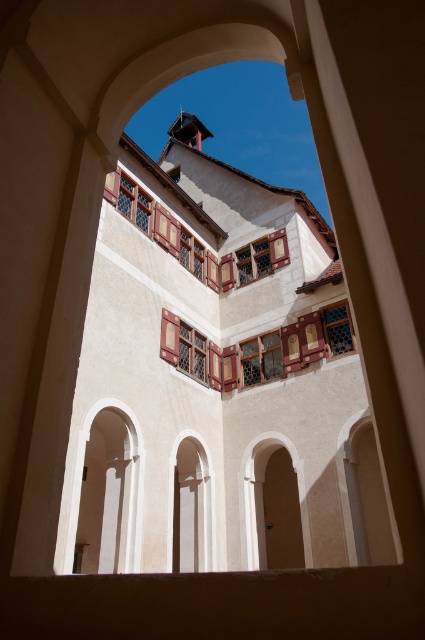
Question: Observing the image, what is the correct spatial positioning of matte glass window at center in reference to wooden stained glass window at upper center?

Choices:
 (A) left
 (B) right

Answer: (B)

Question: Which of these objects is positioned farthest from the wooden stained glass window at upper center?

Choices:
 (A) wooden lattice window at center
 (B) matte glass window at upper right
 (C) white matte archway at center
 (D) matte glass window at center

Answer: (C)

Question: Considering the relative positions of matte glass window at center and wooden stained glass window at upper center in the image provided, where is matte glass window at center located with respect to wooden stained glass window at upper center?

Choices:
 (A) left
 (B) right

Answer: (B)

Question: Which object is positioned farthest from the wooden stained glass window at center?

Choices:
 (A) wooden stained glass window at upper center
 (B) wooden lattice window at center
 (C) matte glass window at center

Answer: (C)

Question: Which point is farther from the camera taking this photo?

Choices:
 (A) (136, 465)
 (B) (149, 224)

Answer: (B)

Question: Can you confirm if white smooth archway at left is positioned above wooden stained glass window at center?

Choices:
 (A) yes
 (B) no

Answer: (B)